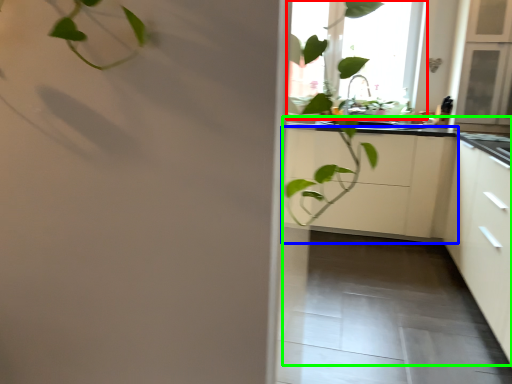
Question: Which object is the farthest from window (highlighted by a red box)? Choose among these: cabinetry (highlighted by a blue box) or counter top (highlighted by a green box).

Choices:
 (A) cabinetry
 (B) counter top

Answer: (B)